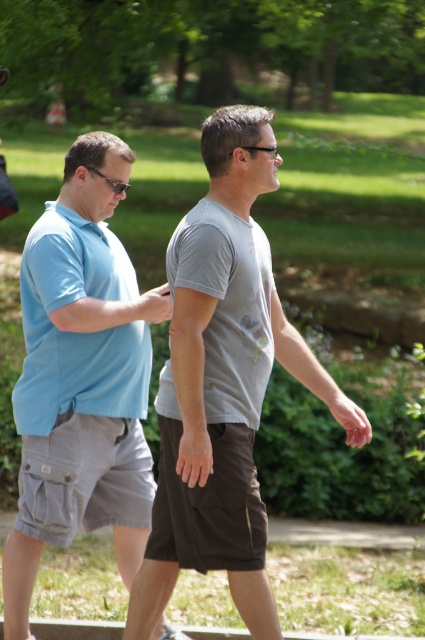
Does gray cotton t-shirt at center appear over matte blue polo shirt at left?

No.

Who is taller, gray cotton t-shirt at center or matte blue polo shirt at left?

With more height is gray cotton t-shirt at center.

Is point (254, 400) positioned after point (70, 355)?

No, it is in front of (70, 355).

Where is `gray cotton t-shirt at center`? This screenshot has width=425, height=640. gray cotton t-shirt at center is located at coordinates (223, 385).

Which of these two, matte blue shirt at left or gray matte t-shirt at center, stands taller?

matte blue shirt at left is taller.

Between matte blue shirt at left and gray matte t-shirt at center, which one is positioned lower?

matte blue shirt at left

You are a GUI agent. You are given a task and a screenshot of the screen. Output one action in this format:
    pyautogui.click(x=<x>, y=<y>)
    Task: Click on the matte blue shirt at left
    The image size is (425, 640).
    Given the screenshot: What is the action you would take?
    pyautogui.click(x=81, y=380)

I want to click on matte blue shirt at left, so click(81, 380).

Who is taller, gray cotton t-shirt at center or black plastic sunglasses at left?

Standing taller between the two is gray cotton t-shirt at center.

Between gray cotton t-shirt at center and black plastic sunglasses at left, which one appears on the right side from the viewer's perspective?

gray cotton t-shirt at center

Describe the element at coordinates (223, 385) in the screenshot. The width and height of the screenshot is (425, 640). I see `gray cotton t-shirt at center` at that location.

Locate an element on the screen. gray cotton t-shirt at center is located at coordinates click(223, 385).